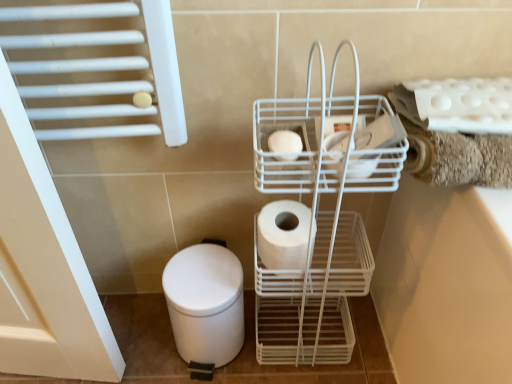
Question: Is white wire trolley at center facing towards white matte toilet paper at center, the 1th toilet paper viewed from the top?

Choices:
 (A) yes
 (B) no

Answer: (A)

Question: Is the depth of white wire trolley at center greater than that of white matte toilet paper at center, the 1th toilet paper viewed from the top?

Choices:
 (A) no
 (B) yes

Answer: (A)

Question: Does white wire trolley at center have a greater width compared to white matte toilet paper at center, the first toilet paper in the front-to-back sequence?

Choices:
 (A) yes
 (B) no

Answer: (A)

Question: From a real-world perspective, is white wire trolley at center on white matte toilet paper at center, the first toilet paper in the front-to-back sequence?

Choices:
 (A) no
 (B) yes

Answer: (A)

Question: Is white wire trolley at center at the left side of white matte toilet paper at center, which is the 2th toilet paper in bottom-to-top order?

Choices:
 (A) no
 (B) yes

Answer: (A)

Question: Is white matte toilet paper at center, which is the 1th toilet paper in back-to-front order, in front of or behind white matte toilet paper at center, the 1th toilet paper viewed from the top, in the image?

Choices:
 (A) front
 (B) behind

Answer: (B)

Question: Considering the positions of white matte toilet paper at center, arranged as the 2th toilet paper when viewed from the top, and white matte toilet paper at center, which is the 2th toilet paper in bottom-to-top order, in the image, is white matte toilet paper at center, arranged as the 2th toilet paper when viewed from the top, bigger or smaller than white matte toilet paper at center, which is the 2th toilet paper in bottom-to-top order,?

Choices:
 (A) small
 (B) big

Answer: (B)

Question: In terms of height, does white matte toilet paper at center, which is counted as the 2th toilet paper, starting from the front, look taller or shorter compared to white matte toilet paper at center, which ranks as the second toilet paper in back-to-front order?

Choices:
 (A) tall
 (B) short

Answer: (A)

Question: In terms of width, does white matte toilet paper at center, arranged as the 2th toilet paper when viewed from the top, look wider or thinner when compared to white matte toilet paper at center, the 1th toilet paper viewed from the top?

Choices:
 (A) thin
 (B) wide

Answer: (B)

Question: Is white matte toilet paper at center, which is the 2th toilet paper in bottom-to-top order, to the left or to the right of white matte toilet paper at center, which is counted as the 2th toilet paper, starting from the front, in the image?

Choices:
 (A) left
 (B) right

Answer: (A)

Question: From the image's perspective, is white matte toilet paper at center, the 1th toilet paper viewed from the top, located above or below white matte toilet paper at center, the 1th toilet paper in the bottom-to-top sequence?

Choices:
 (A) below
 (B) above

Answer: (B)

Question: Considering the positions of white matte toilet paper at center, which ranks as the second toilet paper in back-to-front order, and white matte toilet paper at center, which is counted as the 2th toilet paper, starting from the front, in the image, is white matte toilet paper at center, which ranks as the second toilet paper in back-to-front order, bigger or smaller than white matte toilet paper at center, which is counted as the 2th toilet paper, starting from the front,?

Choices:
 (A) big
 (B) small

Answer: (B)

Question: In the image, is white matte toilet paper at center, which ranks as the second toilet paper in back-to-front order, positioned in front of or behind white matte toilet paper at center, arranged as the 2th toilet paper when viewed from the top?

Choices:
 (A) front
 (B) behind

Answer: (A)

Question: Is white matte toilet paper at center, the 1th toilet paper in the bottom-to-top sequence, bigger or smaller than white matte bidet at lower left?

Choices:
 (A) big
 (B) small

Answer: (B)

Question: Considering the positions of point (313, 238) and point (206, 349), is point (313, 238) closer or farther from the camera than point (206, 349)?

Choices:
 (A) closer
 (B) farther

Answer: (A)